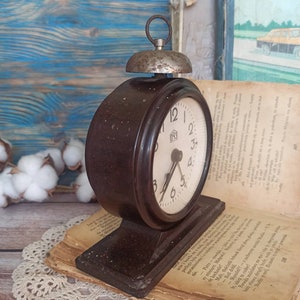
What are the coordinates of `book` in the screenshot? It's located at (231, 244).